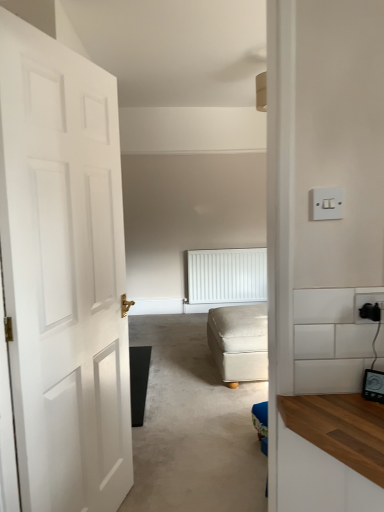
Question: From a real-world perspective, is white matte door at left physically located above or below white textured radiator at center?

Choices:
 (A) below
 (B) above

Answer: (A)

Question: Considering the positions of white matte door at left and white textured radiator at center in the image, is white matte door at left taller or shorter than white textured radiator at center?

Choices:
 (A) tall
 (B) short

Answer: (B)

Question: Estimate the real-world distances between objects in this image. Which object is farther from the white matte door at left?

Choices:
 (A) white textured radiator at center
 (B) black plastic socket at right
 (C) white matte door at left
 (D) beige fabric ottoman at center
 (E) white plastic light switch at upper right

Answer: (A)

Question: Based on their relative distances, which object is nearer to the beige fabric ottoman at center?

Choices:
 (A) black plastic socket at right
 (B) white plastic light switch at upper right
 (C) white matte door at left
 (D) white textured radiator at center
 (E) white matte door at left

Answer: (C)